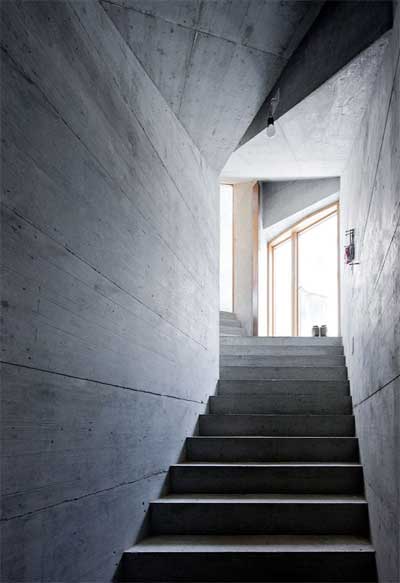
Where is `patio glass door`? patio glass door is located at coordinates (300, 277).